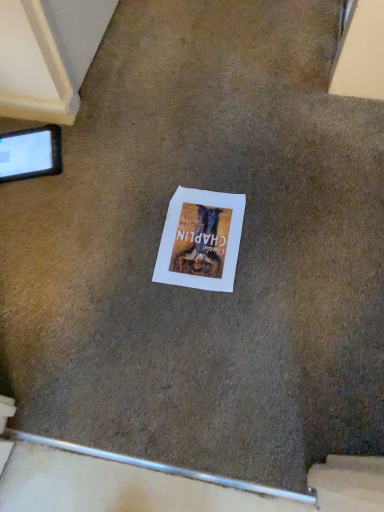
The width and height of the screenshot is (384, 512). What do you see at coordinates (30, 153) in the screenshot?
I see `black glossy tablet at upper left` at bounding box center [30, 153].

This screenshot has height=512, width=384. Find the location of `black glossy tablet at upper left`. black glossy tablet at upper left is located at coordinates (30, 153).

What do you see at coordinates (201, 240) in the screenshot? Image resolution: width=384 pixels, height=512 pixels. I see `white paper at center` at bounding box center [201, 240].

Find the location of a particular element. This screenshot has width=384, height=512. white paper at center is located at coordinates [201, 240].

What are the coordinates of `black glossy tablet at upper left` in the screenshot? It's located at (30, 153).

Between black glossy tablet at upper left and white paper at center, which one appears on the left side from the viewer's perspective?

Positioned to the left is black glossy tablet at upper left.

Is the depth of black glossy tablet at upper left greater than that of white paper at center?

That is True.

Is point (30, 133) closer or farther from the camera than point (221, 222)?

Point (30, 133) is positioned farther from the camera compared to point (221, 222).

From the image's perspective, is black glossy tablet at upper left under white paper at center?

No, from the image's perspective, black glossy tablet at upper left is not beneath white paper at center.

From a real-world perspective, is black glossy tablet at upper left positioned over white paper at center based on gravity?

Yes, from a real-world perspective, black glossy tablet at upper left is above white paper at center.

Can you confirm if black glossy tablet at upper left is thinner than white paper at center?

Yes, black glossy tablet at upper left is thinner than white paper at center.

Considering the relative sizes of black glossy tablet at upper left and white paper at center in the image provided, is black glossy tablet at upper left shorter than white paper at center?

No.

In terms of size, does black glossy tablet at upper left appear bigger or smaller than white paper at center?

black glossy tablet at upper left is bigger than white paper at center.

Choose the correct answer: Is black glossy tablet at upper left inside white paper at center or outside it?

black glossy tablet at upper left is not enclosed by white paper at center.

Is black glossy tablet at upper left touching white paper at center?

No, black glossy tablet at upper left is not making contact with white paper at center.

In the scene shown: Is black glossy tablet at upper left oriented towards white paper at center?

No, black glossy tablet at upper left does not turn towards white paper at center.

Measure the distance between black glossy tablet at upper left and white paper at center.

black glossy tablet at upper left is 18.48 inches away from white paper at center.

Locate an element on the screen. tablet computer behind the white paper at center is located at coordinates (30, 153).

Visually, is white paper at center positioned to the left or to the right of black glossy tablet at upper left?

From the image, it's evident that white paper at center is to the right of black glossy tablet at upper left.

Which object is further away from the camera taking this photo, white paper at center or black glossy tablet at upper left?

black glossy tablet at upper left is more distant.

Is point (193, 269) farther from camera compared to point (11, 160)?

No, (193, 269) is in front of (11, 160).

From the image's perspective, would you say white paper at center is positioned over black glossy tablet at upper left?

No, from the image's perspective, white paper at center is not above black glossy tablet at upper left.

From a real-world perspective, is white paper at center beneath black glossy tablet at upper left?

Yes, from a real-world perspective, white paper at center is beneath black glossy tablet at upper left.

Between white paper at center and black glossy tablet at upper left, which one has larger width?

With larger width is white paper at center.

In terms of height, does white paper at center look taller or shorter compared to black glossy tablet at upper left?

Clearly, white paper at center is shorter compared to black glossy tablet at upper left.

Can you confirm if white paper at center is bigger than black glossy tablet at upper left?

No.

Can black glossy tablet at upper left be found inside white paper at center?

That's incorrect, black glossy tablet at upper left is not inside white paper at center.

Are white paper at center and black glossy tablet at upper left making contact?

No, white paper at center is not with black glossy tablet at upper left.

Is white paper at center looking in the opposite direction of black glossy tablet at upper left?

No.

How different are the orientations of white paper at center and black glossy tablet at upper left in degrees?

The facing directions of white paper at center and black glossy tablet at upper left are 17.6 degrees apart.

How distant is white paper at center from black glossy tablet at upper left?

white paper at center and black glossy tablet at upper left are 46.94 centimeters apart from each other.

There is a white paper at center. Where is `tablet computer above it (from a real-world perspective)`? tablet computer above it (from a real-world perspective) is located at coordinates (30, 153).

Locate an element on the screen. This screenshot has width=384, height=512. flyer below the black glossy tablet at upper left (from the image's perspective) is located at coordinates (201, 240).

The image size is (384, 512). In order to click on tablet computer above the white paper at center (from a real-world perspective) in this screenshot , I will do `click(30, 153)`.